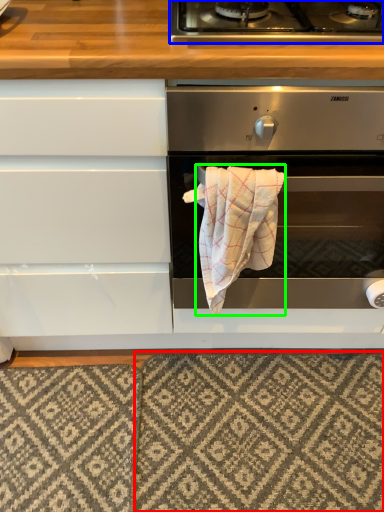
Question: Considering the real-world distances, which object is closest to mat (highlighted by a red box)? gas stove (highlighted by a blue box) or bath towel (highlighted by a green box).

Choices:
 (A) gas stove
 (B) bath towel

Answer: (B)